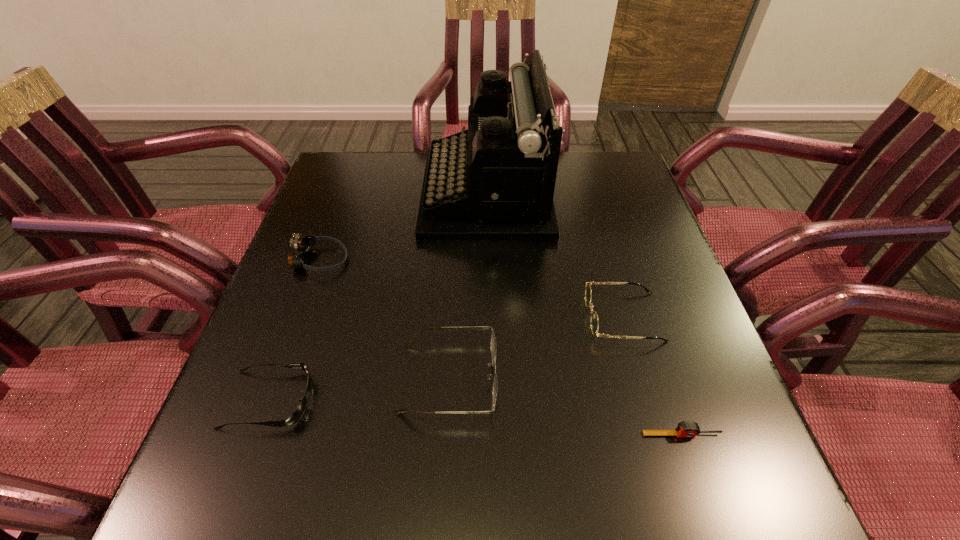
Where is `free space between the fifth nearest object and the typewriter`? The image size is (960, 540). free space between the fifth nearest object and the typewriter is located at coordinates (403, 227).

Image resolution: width=960 pixels, height=540 pixels. I want to click on vacant space that's between the tape measure and the left spectacles, so click(x=564, y=407).

At what (x,y) coordinates should I click in order to perform the action: click on free space between the tape measure and the right spectacles. Please return your answer as a coordinate pair (x, y). Looking at the image, I should click on (653, 376).

I want to click on free point between the typewriter and the left spectacles, so click(468, 286).

Locate an element on the screen. The height and width of the screenshot is (540, 960). free point between the left spectacles and the sunglasses is located at coordinates (358, 389).

Locate an element on the screen. The height and width of the screenshot is (540, 960). empty space between the goggles and the right spectacles is located at coordinates (471, 288).

I want to click on free space between the farthest object and the tape measure, so click(584, 314).

Where is `free space between the goggles and the left spectacles`? free space between the goggles and the left spectacles is located at coordinates (384, 319).

Where is `object that stands as the closest to the sunglasses`? The image size is (960, 540). object that stands as the closest to the sunglasses is located at coordinates (493, 346).

Locate which object is the fifth closest to the sunglasses. Please provide its 2D coordinates. Your answer should be formatted as a tuple, i.e. [(x, y)], where the tuple contains the x and y coordinates of a point satisfying the conditions above.

[(685, 429)]